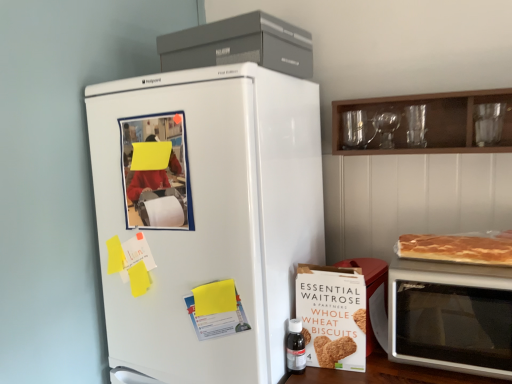
Question: In terms of size, does golden brown flaky pancake at right appear bigger or smaller than white matte refrigerator at left?

Choices:
 (A) small
 (B) big

Answer: (A)

Question: Is golden brown flaky pancake at right wider or thinner than white matte refrigerator at left?

Choices:
 (A) wide
 (B) thin

Answer: (B)

Question: Which is farther from the matte gray refrigerator at upper center?

Choices:
 (A) transparent plastic bottle at lower right
 (B) silver metallic microwave at right
 (C) golden brown flaky pancake at right
 (D) white matte refrigerator at left
 (E) wooden cabinet at upper right

Answer: (A)

Question: Considering the real-world distances, which object is closest to the transparent plastic bottle at lower right?

Choices:
 (A) white cardboard box of whole wheat biscuits at lower right
 (B) wooden cabinet at upper right
 (C) white matte refrigerator at left
 (D) silver metallic microwave at right
 (E) matte gray refrigerator at upper center

Answer: (A)